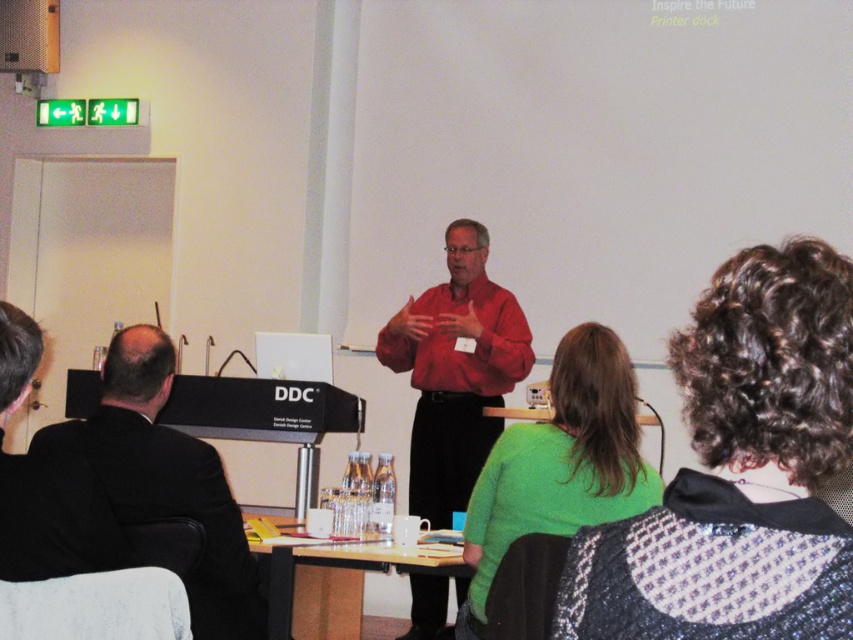
Where is the black suit at left located in the image?

The black suit at left is located at point 0.750 on the x axis and 0.195 on the y axis.

You are an event organizer who needs to arrange seating for the speaker and a guest. The speaker is wearing a matte red shirt at center, and the guest is wearing a black suit at left. Based on their current positions in the image, which one should be seated closer to the front of the stage?

The matte red shirt at center should be seated closer to the front of the stage because it has a greater height compared to the black suit at left.